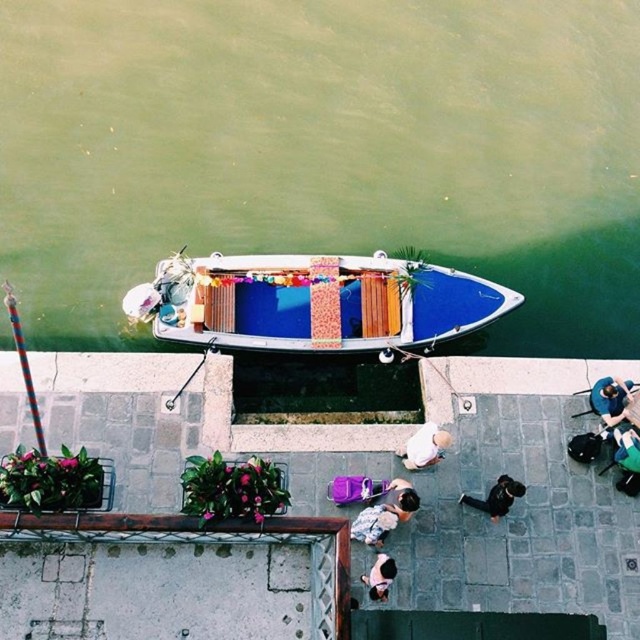
Question: Which of these objects is positioned closest to the smooth beige shirt at center?

Choices:
 (A) green fabric bag at lower right
 (B) wooden planks boat at center

Answer: (B)

Question: Which point is closer to the camera?

Choices:
 (A) blue fabric at lower right
 (B) black smooth jacket at lower center
 (C) green water at boat top
 (D) smooth beige shirt at center

Answer: (D)

Question: Where is green fabric bag at lower right located in relation to black smooth jacket at lower center in the image?

Choices:
 (A) left
 (B) right

Answer: (B)

Question: Does green water at boat top appear under blue fabric at lower right?

Choices:
 (A) yes
 (B) no

Answer: (B)

Question: Is green water at boat top wider than blue fabric at lower right?

Choices:
 (A) yes
 (B) no

Answer: (A)

Question: Based on their relative distances, which object is nearer to the green fabric bag at lower right?

Choices:
 (A) blue fabric at lower right
 (B) light brown leather jacket at lower center
 (C) black smooth jacket at lower center
 (D) wooden planks boat at center

Answer: (A)